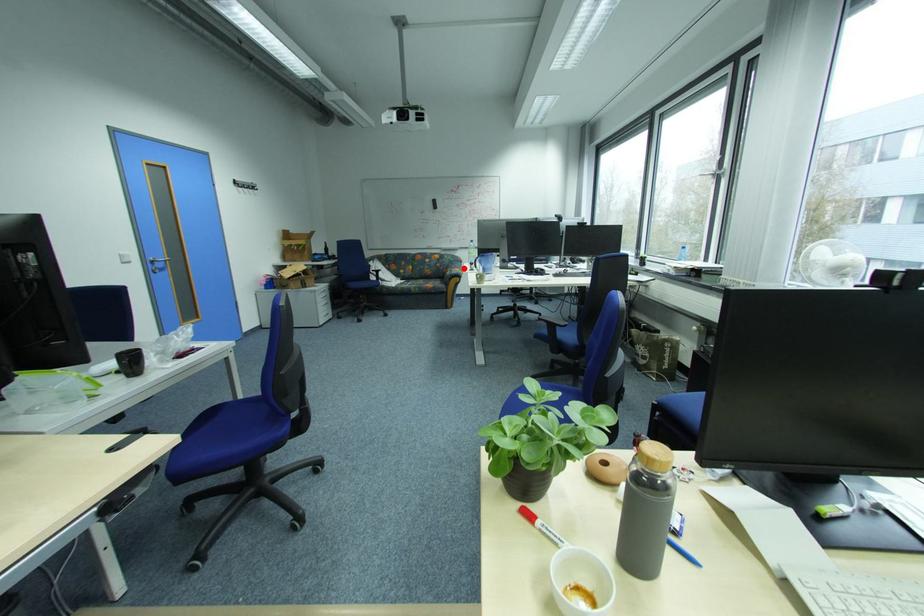
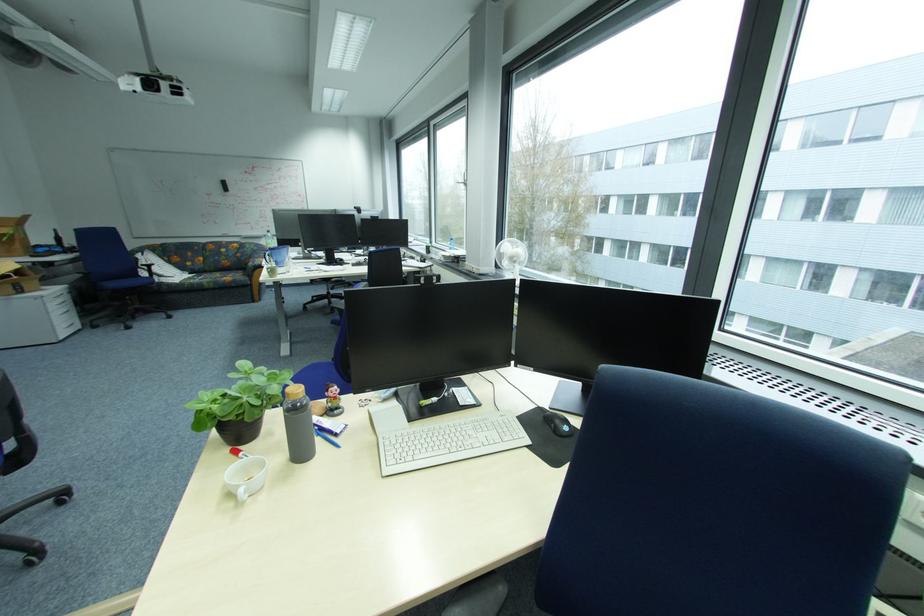
Where in the second image is the point corresponding to the highlighted location from the first image?

(268, 257)